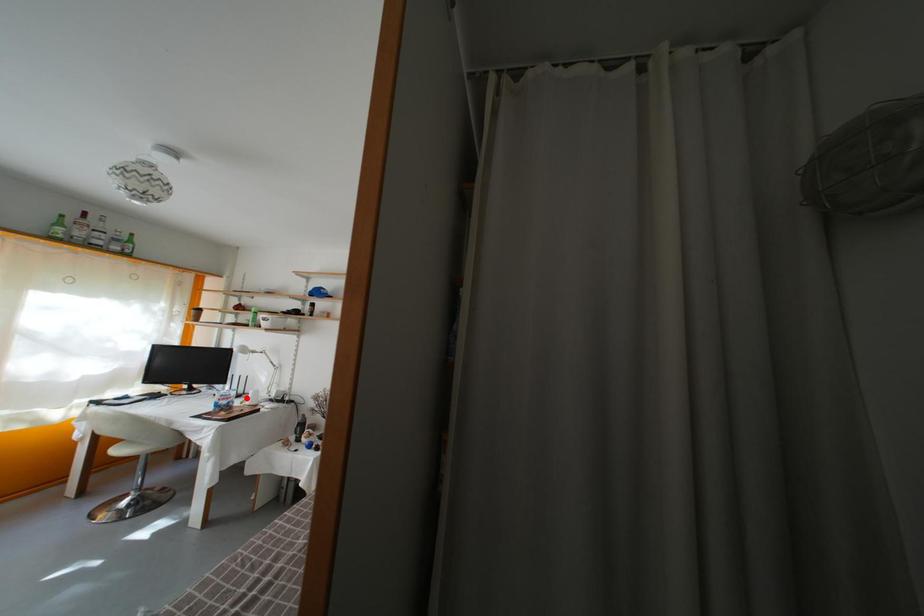
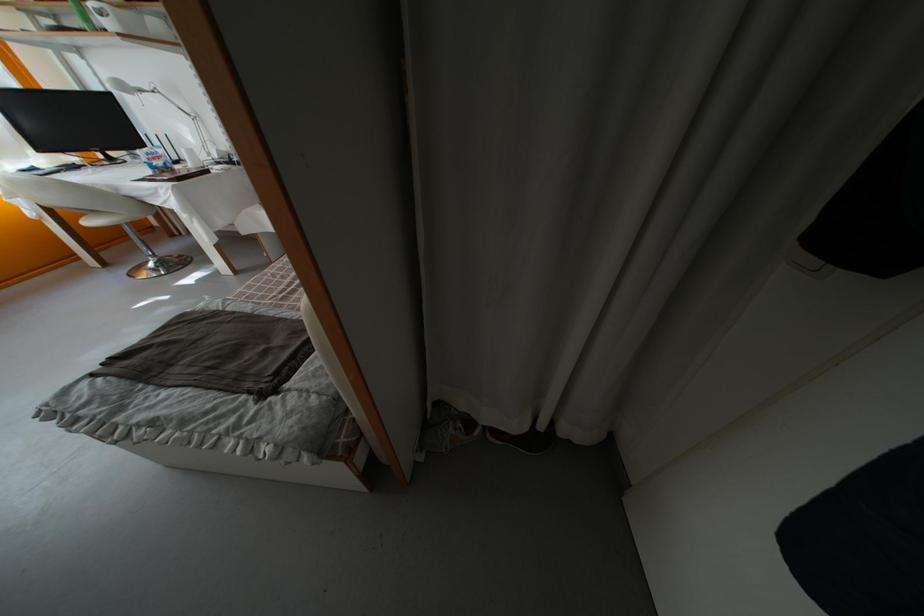
Where in the second image is the point corresponding to the highlighted location from the first image?

(180, 164)